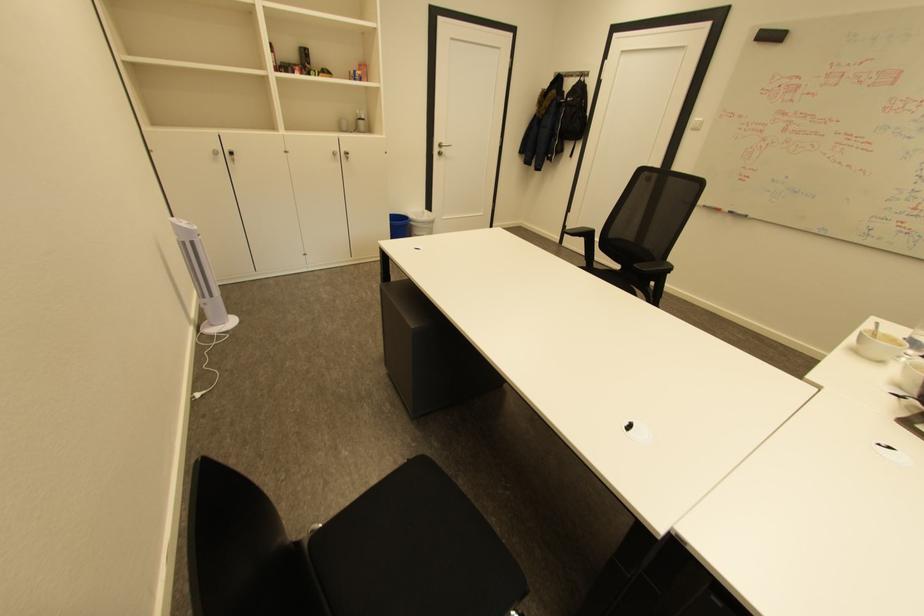
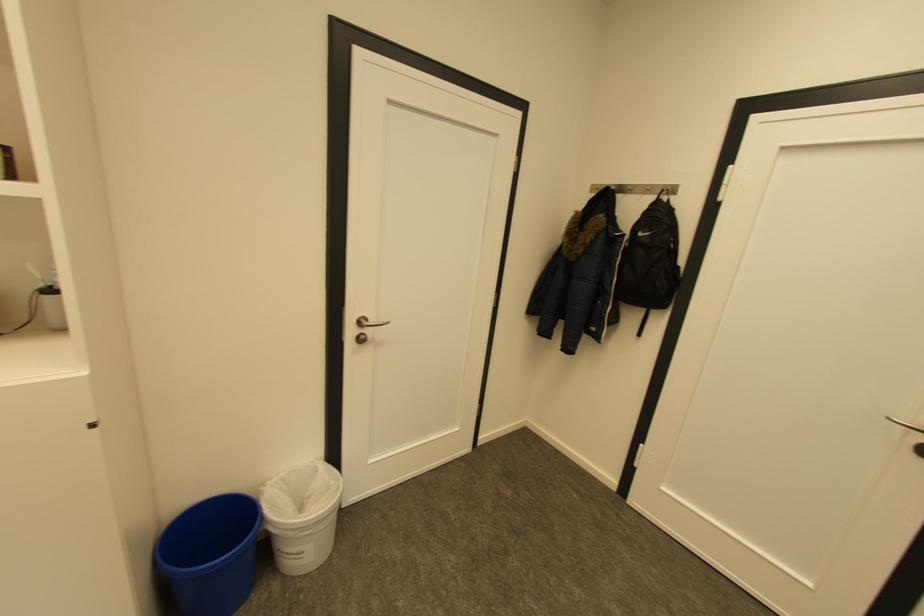
Where in the second image is the point corresponding to (x=592, y=74) from the first image?

(677, 190)